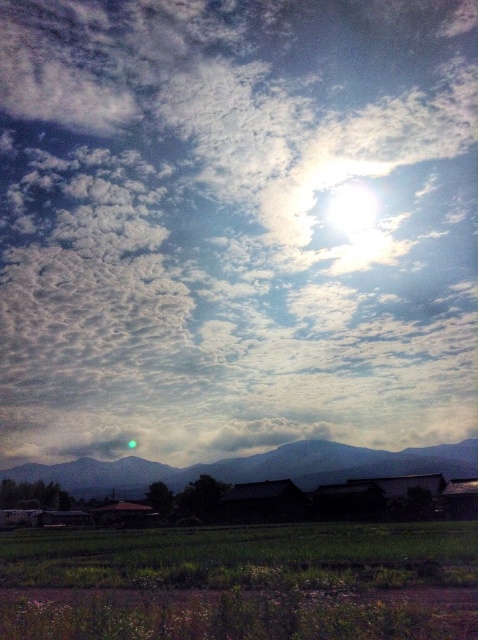
Is green grassy rice field at lower center wider than dark gray mountain at center?

No.

Who is positioned more to the right, green grassy rice field at lower center or dark gray mountain at center?

From the viewer's perspective, green grassy rice field at lower center appears more on the right side.

Is point (159, 628) positioned in front of point (17, 468)?

Yes, it is.

Where is `green grassy rice field at lower center`? green grassy rice field at lower center is located at coordinates (241, 582).

Between white fluffy cloud at upper center and green grassy rice field at lower center, which one appears on the right side from the viewer's perspective?

Positioned to the right is green grassy rice field at lower center.

Is white fluffy cloud at upper center closer to camera compared to green grassy rice field at lower center?

No, it is not.

Is point (391, 0) positioned after point (117, 564)?

Yes.

Find the location of a particular element. white fluffy cloud at upper center is located at coordinates (236, 225).

In the scene shown: Which is more to the right, white fluffy cloud at upper center or dark gray mountain at center?

Positioned to the right is white fluffy cloud at upper center.

Does white fluffy cloud at upper center appear under dark gray mountain at center?

No, white fluffy cloud at upper center is not below dark gray mountain at center.

Is point (308, 304) farther from viewer compared to point (129, 460)?

Yes.

Where is `white fluffy cloud at upper center`? This screenshot has width=478, height=640. white fluffy cloud at upper center is located at coordinates (236, 225).